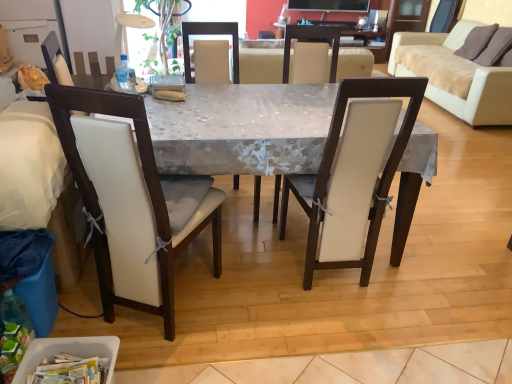
The height and width of the screenshot is (384, 512). What are the coordinates of `free space in front of white leather chair at center, which is the second chair from left to right` in the screenshot? It's located at (243, 246).